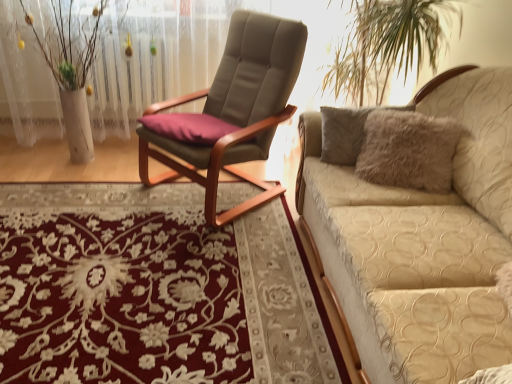
This screenshot has height=384, width=512. Identify the location of free point above floral carpet at center (from a real-world perspective). (120, 256).